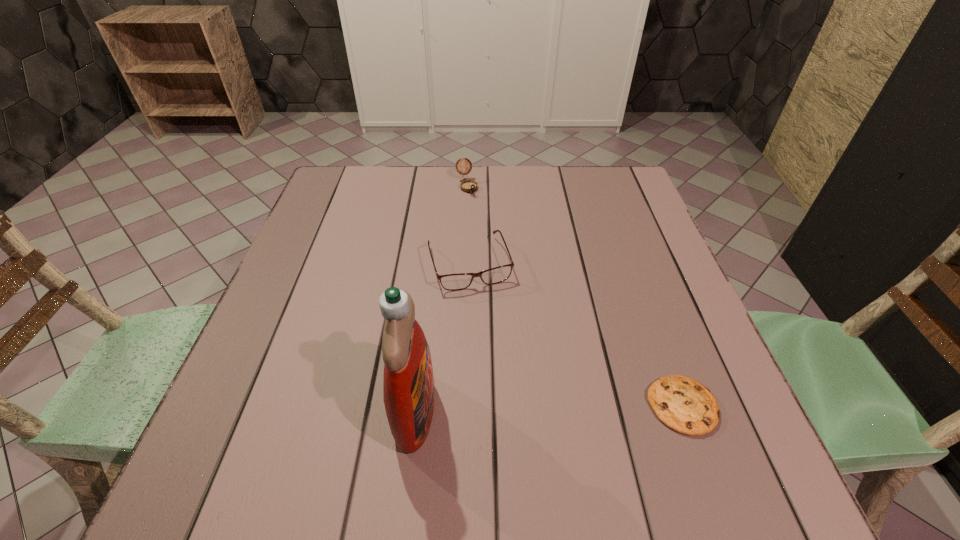
Identify the location of free space between the detergent and the rightmost object. (548, 408).

This screenshot has height=540, width=960. I want to click on vacant space in between the spectacles and the tallest object, so click(443, 336).

This screenshot has height=540, width=960. I want to click on free spot between the rightmost object and the spectacles, so click(x=576, y=334).

At what (x,y) coordinates should I click in order to perform the action: click on free spot between the tallest object and the compass. Please return your answer as a coordinate pair (x, y). This screenshot has height=540, width=960. Looking at the image, I should click on (441, 299).

The image size is (960, 540). I want to click on vacant area that lies between the spectacles and the shortest object, so click(x=576, y=334).

You are a GUI agent. You are given a task and a screenshot of the screen. Output one action in this format:
    pyautogui.click(x=<x>, y=<y>)
    Task: Click on the vacant region between the cookie and the farthest object
    Image resolution: width=960 pixels, height=540 pixels.
    Given the screenshot: What is the action you would take?
    pyautogui.click(x=574, y=296)

The image size is (960, 540). I want to click on object that stands as the third closest to the third tallest object, so click(683, 404).

Locate which object ranks in proximity to the cookie. Please provide its 2D coordinates. Your answer should be formatted as a tuple, i.e. [(x, y)], where the tuple contains the x and y coordinates of a point satisfying the conditions above.

[(452, 282)]